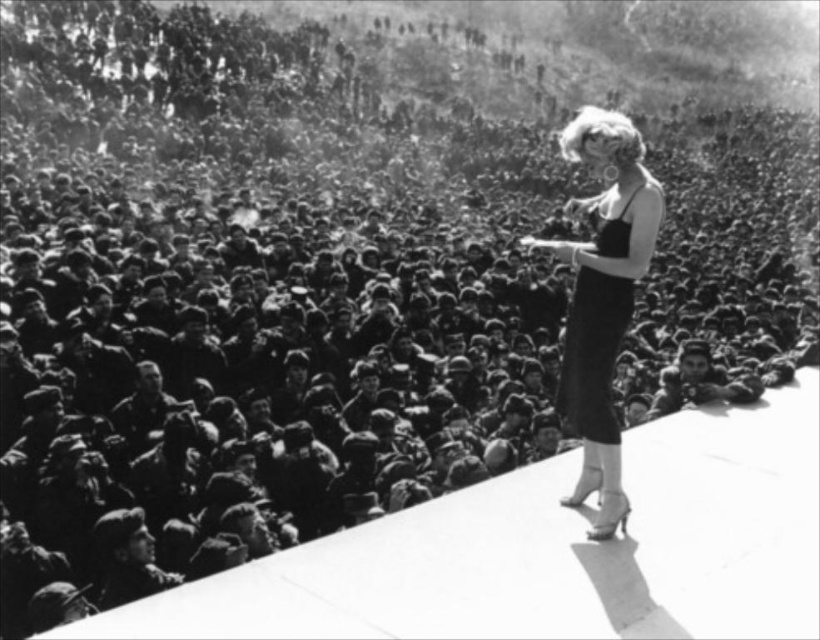
Question: Is black satin dress at center to the right of satin black dress at upper right from the viewer's perspective?

Choices:
 (A) yes
 (B) no

Answer: (A)

Question: Is black satin dress at center smaller than satin black dress at upper right?

Choices:
 (A) no
 (B) yes

Answer: (A)

Question: Does black satin dress at center appear under satin black dress at upper right?

Choices:
 (A) yes
 (B) no

Answer: (B)

Question: Among these points, which one is nearest to the camera?

Choices:
 (A) (604, 150)
 (B) (581, 282)

Answer: (A)

Question: Which point is farther to the camera?

Choices:
 (A) satin black dress at upper right
 (B) black satin dress at center

Answer: (A)